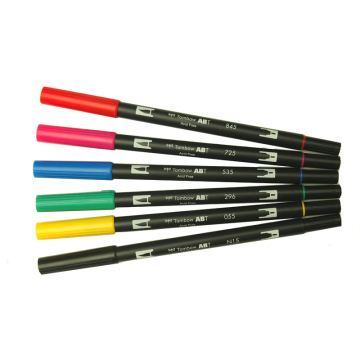
Image resolution: width=360 pixels, height=360 pixels. Identify the location of marker. (171, 245), (178, 221), (186, 199), (200, 169), (206, 152), (216, 125).